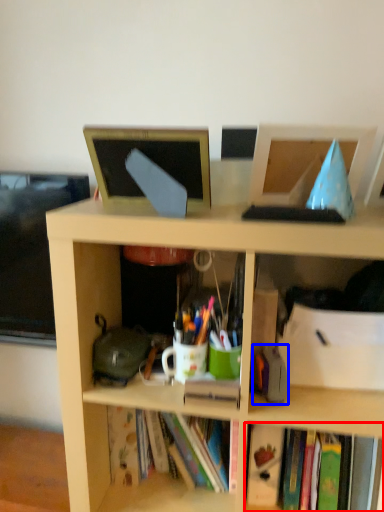
Question: Which point is closer to the camera, book (highlighted by a red box) or stationery (highlighted by a blue box)?

Choices:
 (A) book
 (B) stationery

Answer: (B)